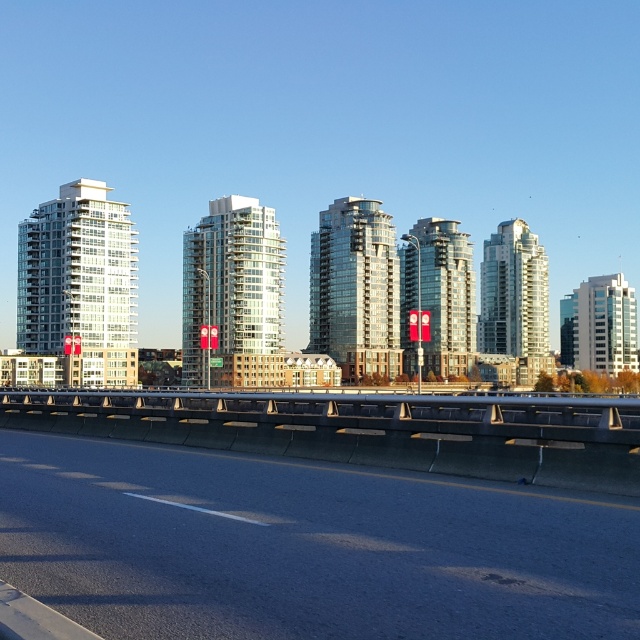
You are a city planner analyzing the urban layout. You observe the glassy white building at center and the glossy glass building at center. Which building occupies a greater area in the cityscape?

The glassy white building at center is larger in size than the glossy glass building at center, so it occupies a greater area in the cityscape.

You are a delivery drone flying over the city. You need to deliver a package to the white glass building at left, but you must avoid flying over the black asphalt highway at lower center. Can you safely fly between them?

The black asphalt highway at lower center is positioned under the white glass building at left, so the drone can safely fly between them without crossing the highway.